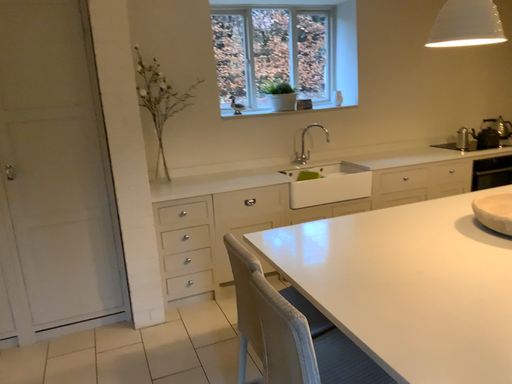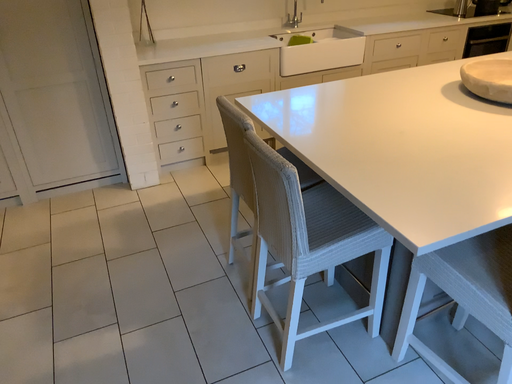
Question: Which way did the camera rotate in the video?

Choices:
 (A) rotated upward
 (B) rotated downward

Answer: (B)